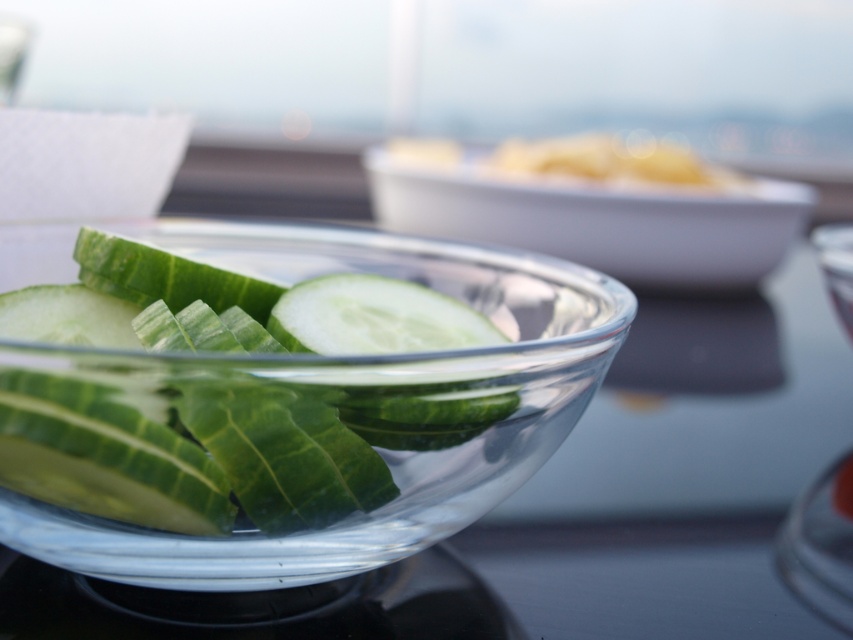
Question: Does transparent glass bowl at center have a larger size compared to clear glass bowl at center?

Choices:
 (A) no
 (B) yes

Answer: (A)

Question: Which of the following is the closest to the observer?

Choices:
 (A) clear glass bowl at center
 (B) transparent glass bowl at center

Answer: (B)

Question: Which of the following is the farthest from the observer?

Choices:
 (A) (267, 509)
 (B) (666, 188)

Answer: (B)

Question: Which point is farther to the camera?

Choices:
 (A) clear glass bowl at center
 (B) transparent glass bowl at center

Answer: (A)

Question: Is transparent glass bowl at center wider than clear glass bowl at center?

Choices:
 (A) no
 (B) yes

Answer: (A)

Question: Can you confirm if transparent glass bowl at center is positioned to the right of clear glass bowl at center?

Choices:
 (A) yes
 (B) no

Answer: (B)